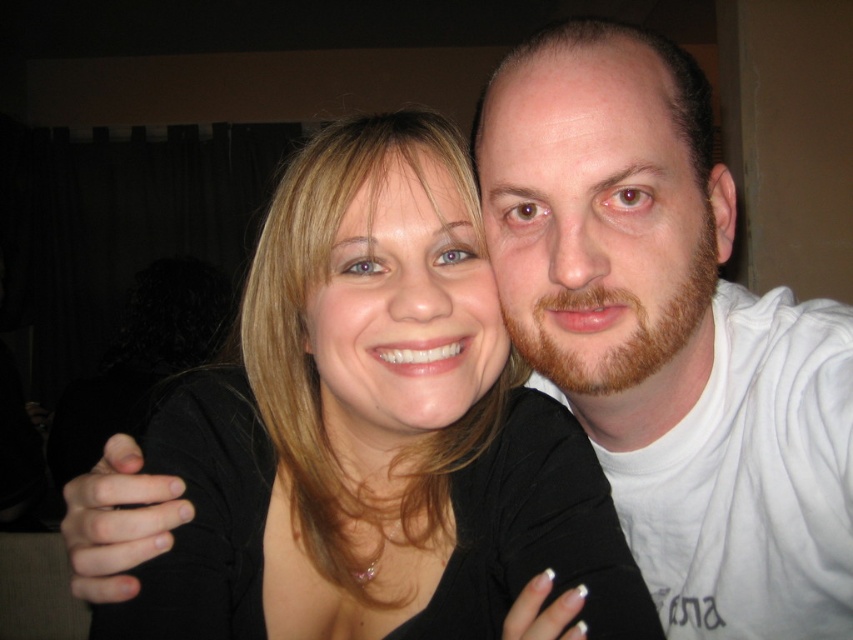
Question: Among these points, which one is nearest to the camera?

Choices:
 (A) (358, 266)
 (B) (492, 189)

Answer: (A)

Question: Is black matte hair at center in front of white cotton shirt at upper right?

Choices:
 (A) no
 (B) yes

Answer: (B)

Question: Which point is farther from the camera taking this photo?

Choices:
 (A) (595, 54)
 (B) (323, 234)

Answer: (B)

Question: Does black matte hair at center have a smaller size compared to white cotton shirt at upper right?

Choices:
 (A) yes
 (B) no

Answer: (A)

Question: Is black matte hair at center above white cotton shirt at upper right?

Choices:
 (A) yes
 (B) no

Answer: (A)

Question: Which point is farther to the camera?

Choices:
 (A) (717, 241)
 (B) (427, 625)

Answer: (A)